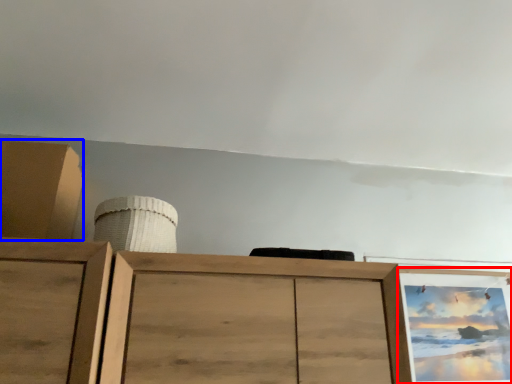
Question: Which of the following is the farthest to the observer, picture frame (highlighted by a red box) or cabinetry (highlighted by a blue box)?

Choices:
 (A) picture frame
 (B) cabinetry

Answer: (A)